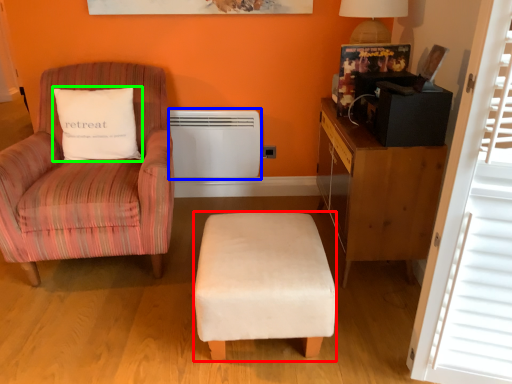
Question: Estimate the real-world distances between objects in this image. Which object is farther from stool (highlighted by a red box), heater (highlighted by a blue box) or pillow (highlighted by a green box)?

Choices:
 (A) heater
 (B) pillow

Answer: (A)